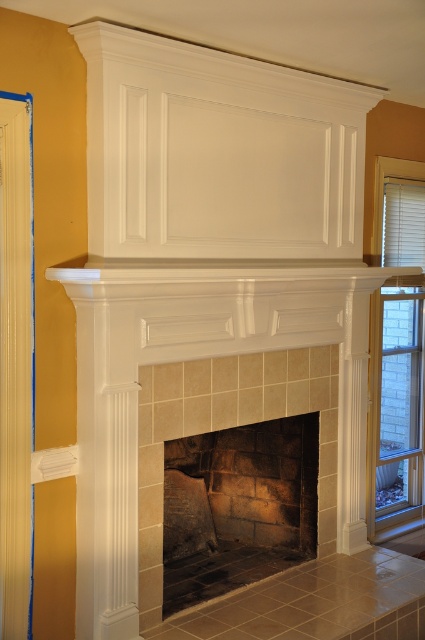
Question: Which point is farther to the camera?

Choices:
 (A) (176, 440)
 (B) (382, 444)

Answer: (B)

Question: Is dark stone fireplace at center above white blinds at right?

Choices:
 (A) yes
 (B) no

Answer: (B)

Question: Does dark stone fireplace at center come behind white blinds at right?

Choices:
 (A) no
 (B) yes

Answer: (A)

Question: Can you confirm if dark stone fireplace at center is bigger than white blinds at right?

Choices:
 (A) yes
 (B) no

Answer: (B)